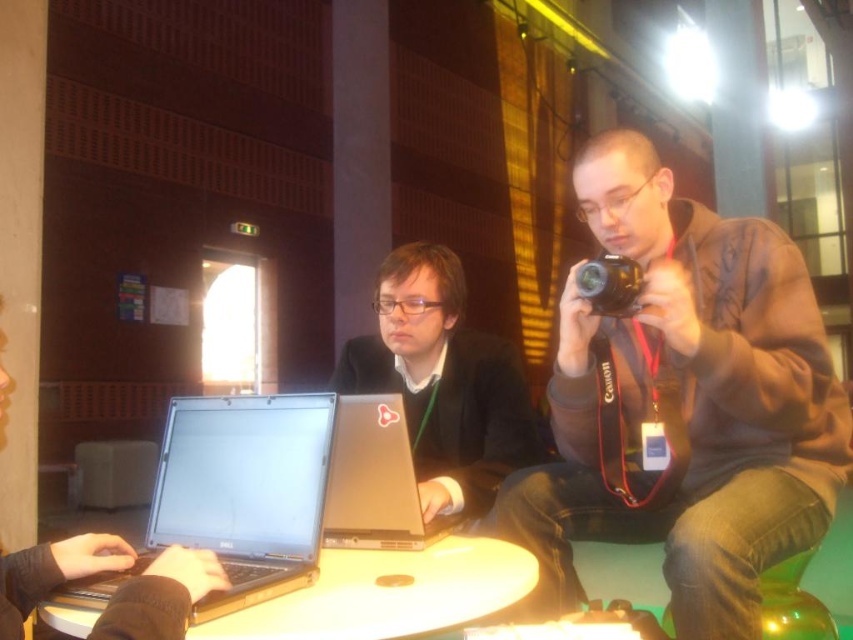
In the scene shown: Is brown leather jacket at center taller than silver metallic laptop at center?

Correct, brown leather jacket at center is much taller as silver metallic laptop at center.

Can you confirm if brown leather jacket at center is wider than silver metallic laptop at center?

Yes.

Locate an element on the screen. brown leather jacket at center is located at coordinates (683, 403).

Where is `brown leather jacket at center`? The width and height of the screenshot is (853, 640). brown leather jacket at center is located at coordinates (683, 403).

Measure the distance from white glossy round table at center to silver metallic laptop at center.

The distance of white glossy round table at center from silver metallic laptop at center is 5.27 inches.

Does white glossy round table at center appear under silver metallic laptop at center?

Correct, white glossy round table at center is located below silver metallic laptop at center.

Measure the distance between point (413, 632) and camera.

The distance of point (413, 632) from camera is 35.00 inches.

This screenshot has width=853, height=640. What are the coordinates of `white glossy round table at center` in the screenshot? It's located at (390, 593).

Does matte black laptop at center have a greater height compared to white glossy round table at center?

Yes, matte black laptop at center is taller than white glossy round table at center.

Does matte black laptop at center appear on the left side of white glossy round table at center?

No, matte black laptop at center is not to the left of white glossy round table at center.

Is point (537, 461) in front of point (434, 628)?

That is False.

At what (x,y) coordinates should I click in order to perform the action: click on matte black laptop at center. Please return your answer as a coordinate pair (x, y). Image resolution: width=853 pixels, height=640 pixels. Looking at the image, I should click on (444, 381).